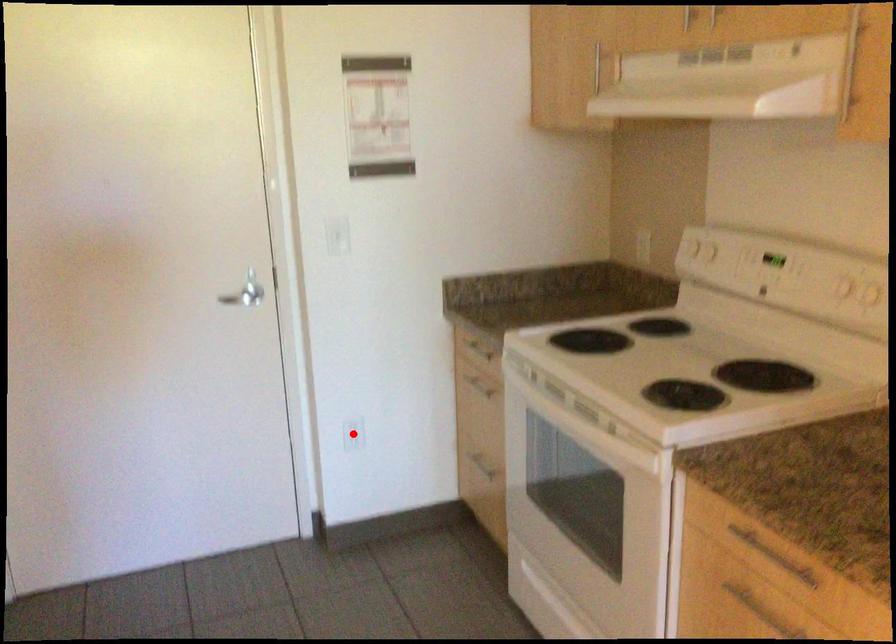
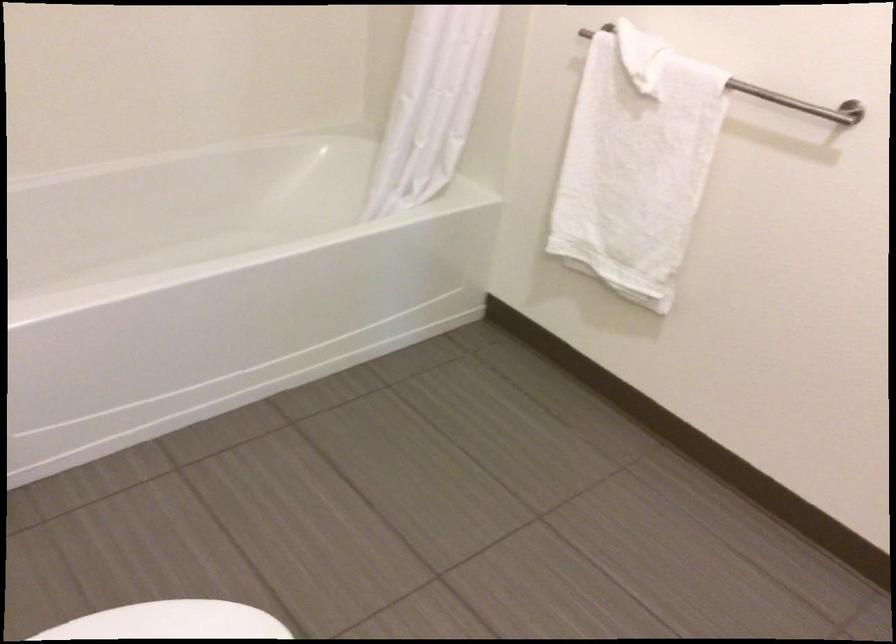
Question: I am providing you with two images of the same scene from different viewpoints. A red point is marked on the first image. At the location where the point appears in image 1, is it still visible in image 2?

Choices:
 (A) Yes
 (B) No

Answer: (B)